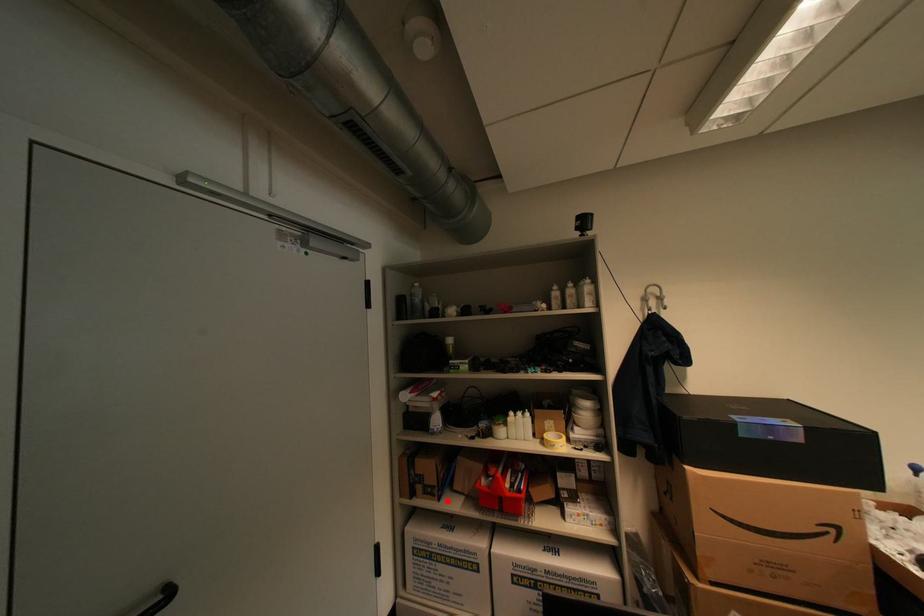
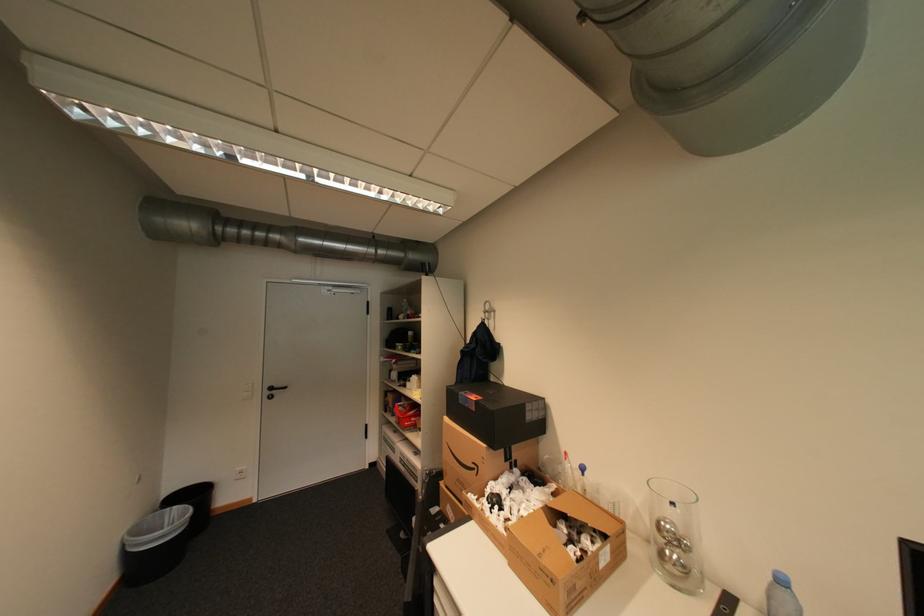
Question: A red point is marked in image1. In image2, is the corresponding 3D point closer to the camera or farther? Reply with the corresponding letter.

Choices:
 (A) The corresponding 3D point is closer.
 (B) The corresponding 3D point is farther.

Answer: (B)